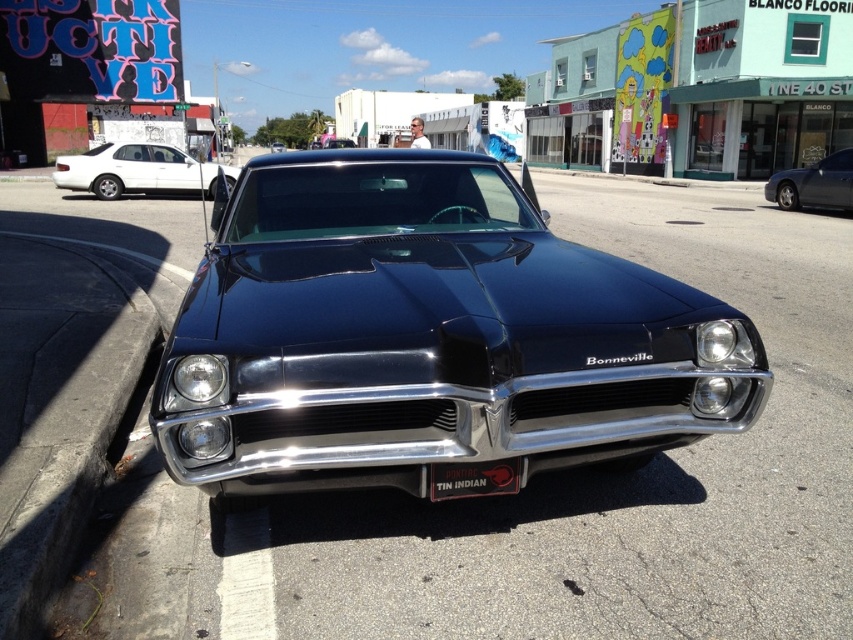
You are a pedestrian standing on the sidewalk and want to cross the street where the shiny black car at center and the white glossy sedan at upper left are parked. Which car is closer to you as you stand on the sidewalk?

The shiny black car at center is closer to you because it is in front of the white glossy sedan at upper left, meaning it is positioned nearer to the sidewalk where you are standing.

You are a delivery person trying to unload a package from the trunk of your vehicle. You have two cars in view, the shiny black car at center and the satin black sedan at right. Which car should you approach first if you want to access the trunk without moving any vehicles?

You should approach the shiny black car at center first because it is in front of the satin black sedan at right, so you can access its trunk without needing to move any vehicles.

You are a delivery person trying to park your van next to the shiny black car at center. The parking spot has a width restriction of 2 meters. The black matte license plate at center is 0.5 meters wide. Can you safely park your van here?

The shiny black car at center might be wider than black matte license plate at center. Since the license plate is 0.5 meters wide, the car could be wider than that. However, without knowing the exact width of the car, it is uncertain if it fits within the 2 meter restriction. Please check the car dimensions before deciding.